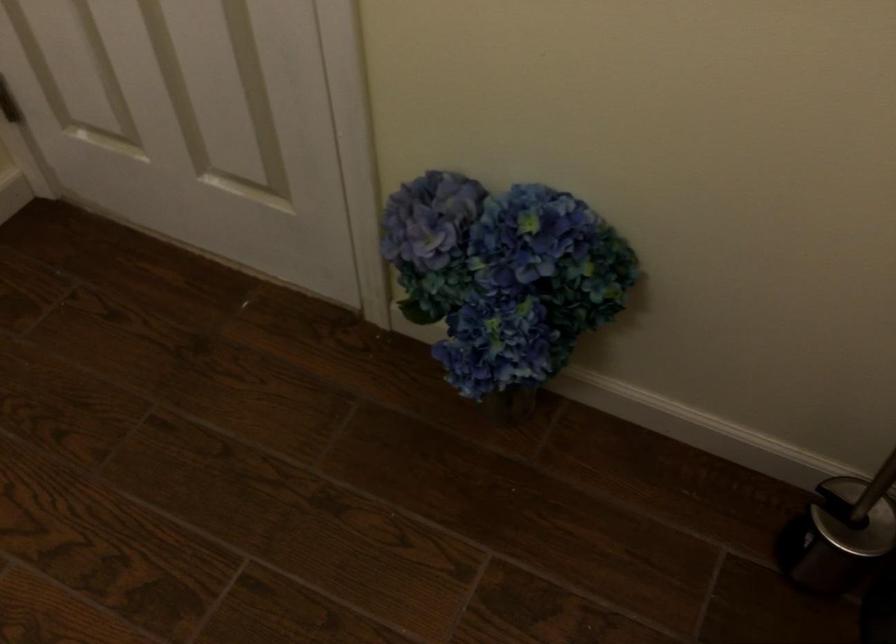
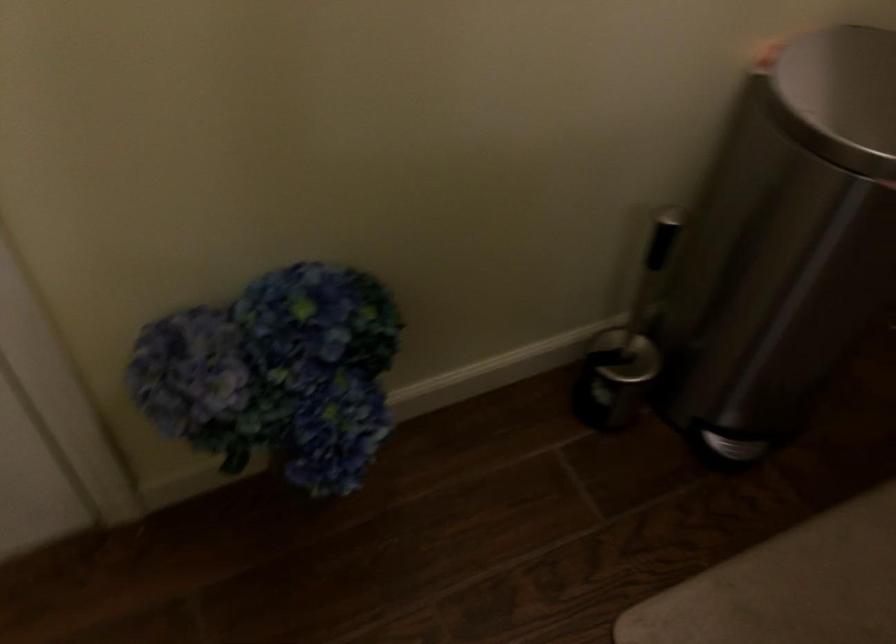
Question: The camera is either moving clockwise (left) or counter-clockwise (right) around the object. The first image is from the beginning of the video and the second image is from the end. Is the camera moving left or right when shooting the video?

Choices:
 (A) Left
 (B) Right

Answer: (A)